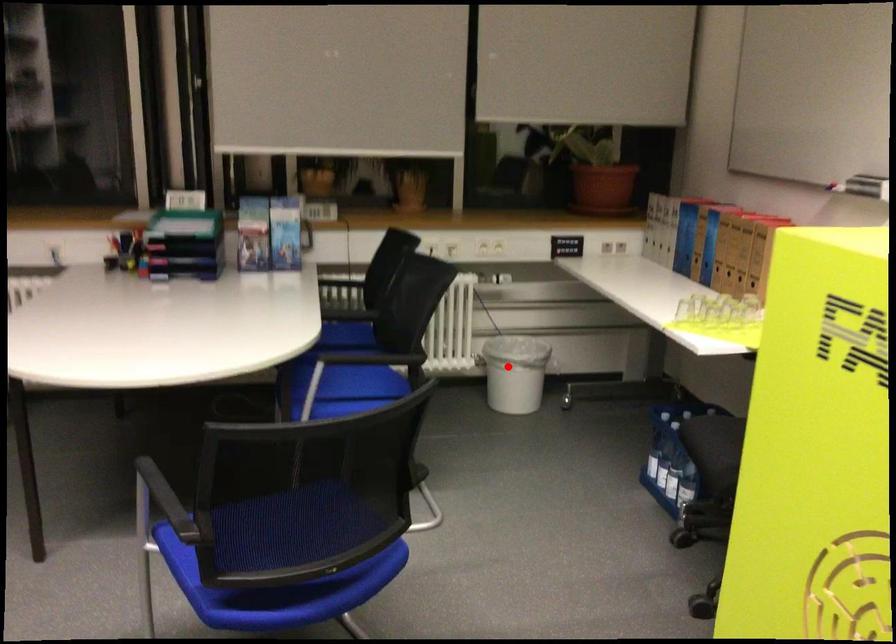
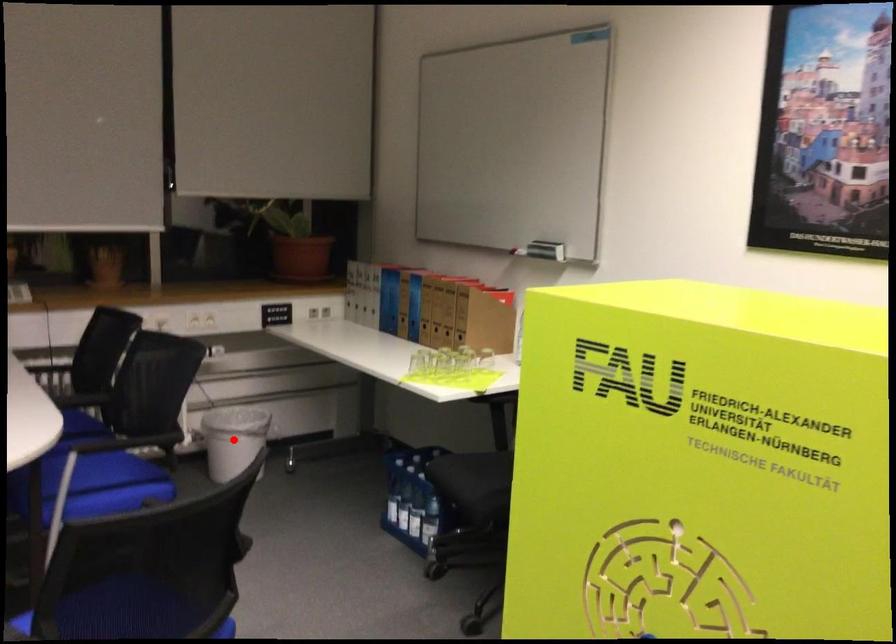
I am providing you with two images of the same scene from different viewpoints. A red point is marked on the first image and another point is marked on the second image. Is the red point in image1 aligned with the point shown in image2?

Yes